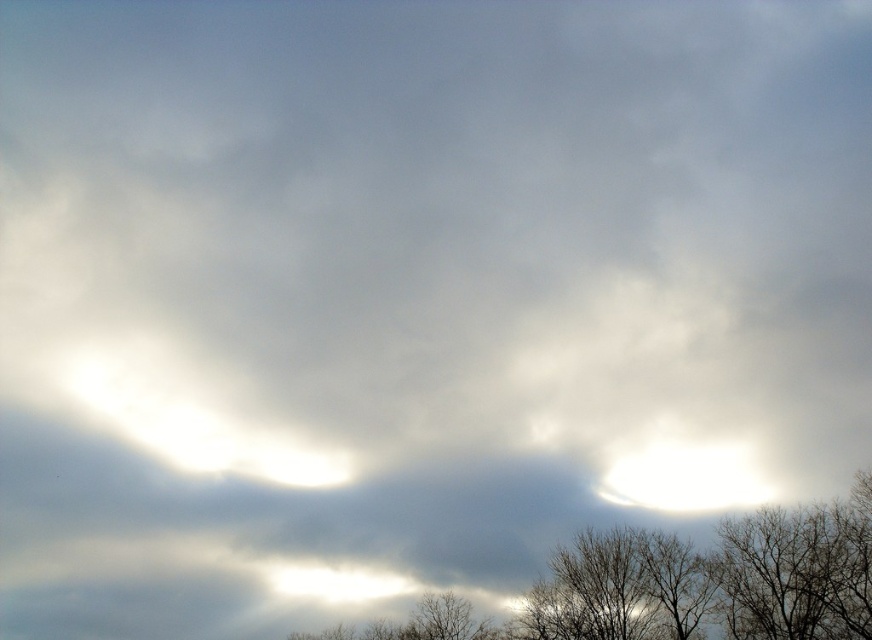
You are an artist sketching the scene and want to draw the bare branches at lower center and the bare branches at lower right in their correct positions. Which bare branches are positioned to the left of the other?

The bare branches at lower center are positioned to the left of the bare branches at lower right.

From the picture: You are an artist trying to paint the scene. You want to ensure the bare branches at lower center and the bare branches at lower right are proportionate. Which of the two should you draw taller?

The bare branches at lower center should be drawn taller than the bare branches at lower right.